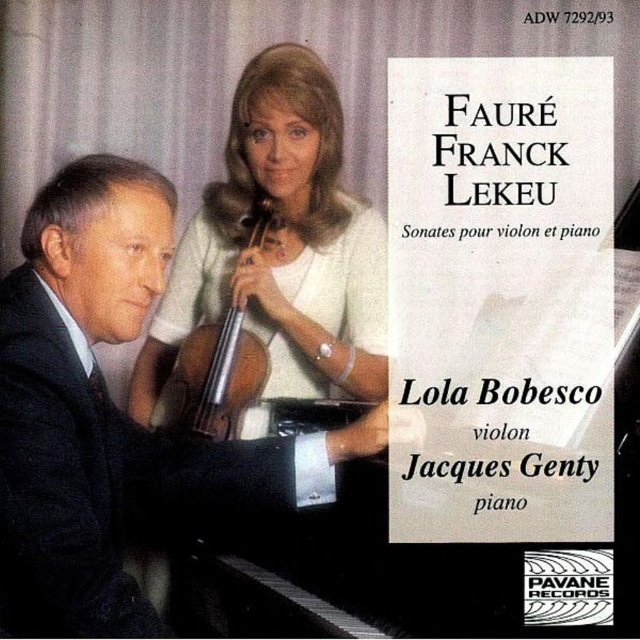
You are a photographer setting up for a photo shoot. You need to ensure that the black suit at left and the matte white violin at upper center are both visible in your frame. Given their sizes, which object will require more space vertically in the camera frame?

The black suit at left is much taller than the matte white violin at upper center, so it will require more vertical space in the camera frame.

You are designing a poster for this album cover and need to ensure the black suit at left and the matte white violin at upper center are visible. Given that the poster has limited space, which object should you consider scaling down to maintain proportions?

The black suit at left is larger in width than the matte white violin at upper center, so scaling down the black suit at left would help maintain proportions while fitting both elements into the limited space.